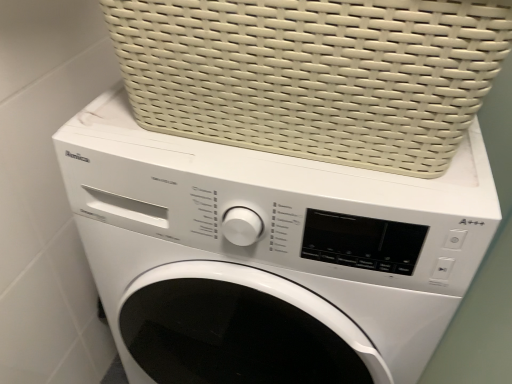
Question: In terms of size, does white glossy washing machine at center appear bigger or smaller than white woven basket at upper center?

Choices:
 (A) big
 (B) small

Answer: (A)

Question: Considering their positions, is white glossy washing machine at center located in front of or behind white woven basket at upper center?

Choices:
 (A) behind
 (B) front

Answer: (A)

Question: Considering the positions of point (150, 170) and point (359, 79), is point (150, 170) closer or farther from the camera than point (359, 79)?

Choices:
 (A) farther
 (B) closer

Answer: (A)

Question: In terms of width, does white woven basket at upper center look wider or thinner when compared to white glossy washing machine at center?

Choices:
 (A) thin
 (B) wide

Answer: (A)

Question: From the image's perspective, is white woven basket at upper center positioned above or below white glossy washing machine at center?

Choices:
 (A) above
 (B) below

Answer: (A)

Question: From their relative heights in the image, would you say white woven basket at upper center is taller or shorter than white glossy washing machine at center?

Choices:
 (A) tall
 (B) short

Answer: (B)

Question: From a real-world perspective, is white woven basket at upper center above or below white glossy washing machine at center?

Choices:
 (A) below
 (B) above

Answer: (B)